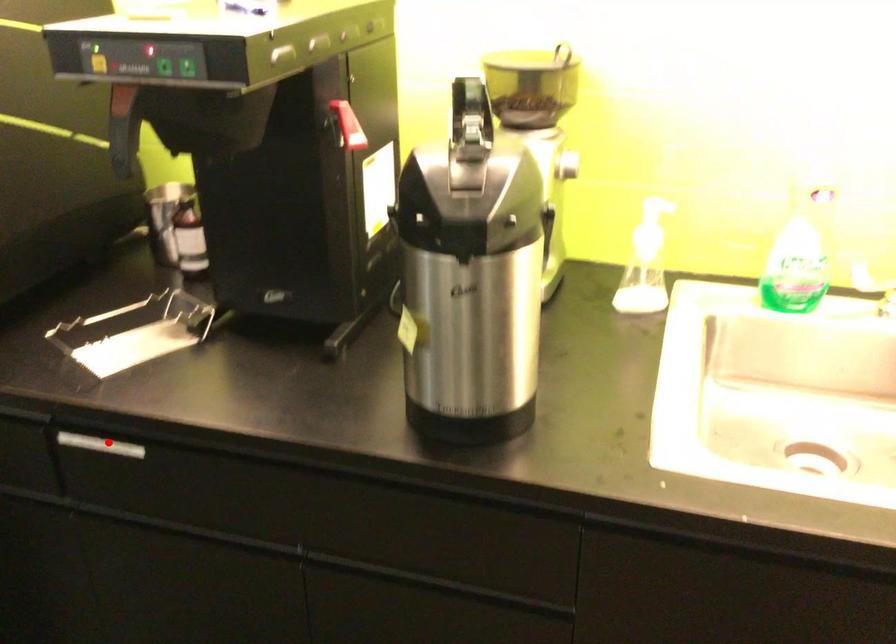
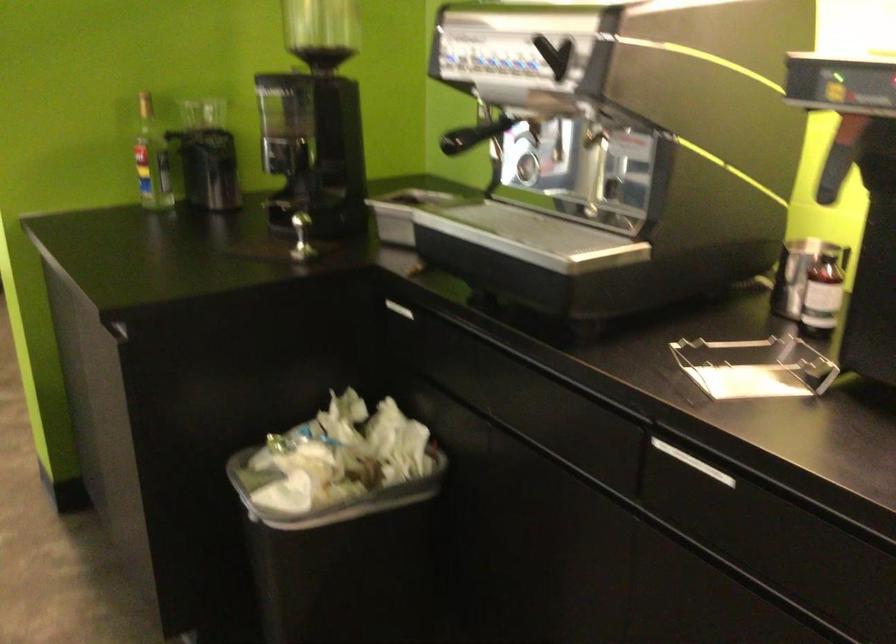
In the second image, find the point that corresponds to the highlighted location in the first image.

(693, 462)